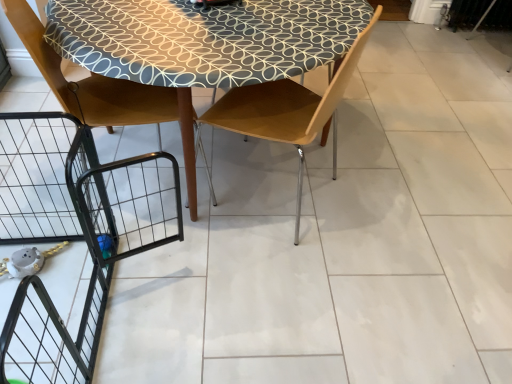
This screenshot has height=384, width=512. I want to click on vacant point to the left of matte brown chair at left, the 2th chair in the right-to-left sequence, so click(x=38, y=177).